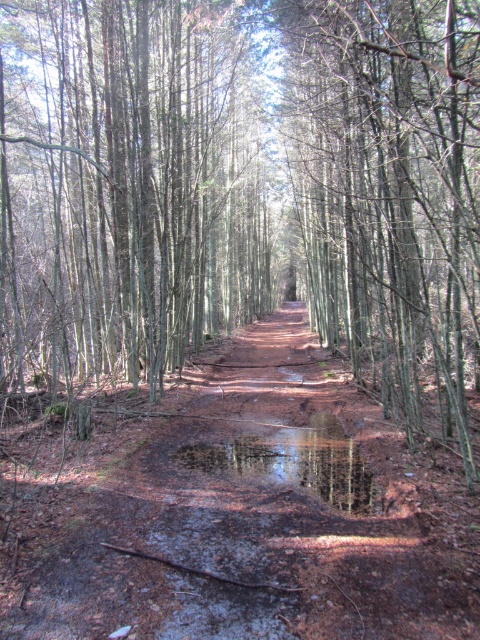
Does brown dirt track at center appear on the right side of glossy reflective puddle at center?

No, brown dirt track at center is not to the right of glossy reflective puddle at center.

Image resolution: width=480 pixels, height=640 pixels. What are the coordinates of `brown dirt track at center` in the screenshot? It's located at (237, 508).

Locate an element on the screen. The image size is (480, 640). brown dirt track at center is located at coordinates (237, 508).

What are the coordinates of `brown dirt track at center` in the screenshot? It's located at (237, 508).

Measure the distance between smooth bark tree at center and glossy reflective puddle at center.

They are 20.37 feet apart.

Is smooth bark tree at center bigger than glossy reflective puddle at center?

Indeed, smooth bark tree at center has a larger size compared to glossy reflective puddle at center.

The width and height of the screenshot is (480, 640). I want to click on smooth bark tree at center, so click(x=389, y=193).

I want to click on smooth bark tree at center, so click(x=389, y=193).

Is point (312, 388) closer to camera compared to point (348, 38)?

No, (312, 388) is behind (348, 38).

Is point (86, 636) positioned behind point (354, 115)?

No, it is in front of (354, 115).

Is point (476, 528) behind point (360, 26)?

No, it is in front of (360, 26).

Find the location of a particular element. The height and width of the screenshot is (640, 480). brown dirt track at center is located at coordinates (237, 508).